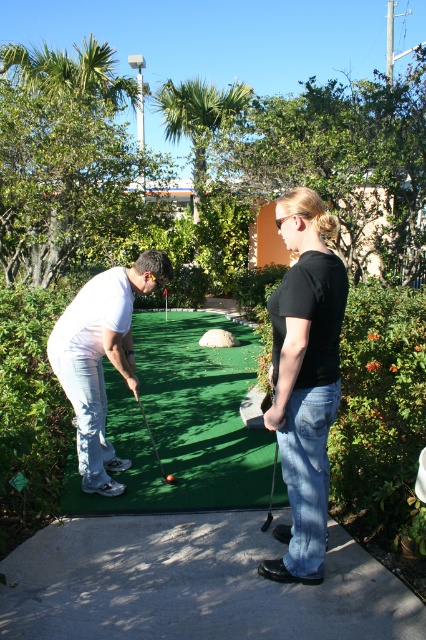
Question: Is white matte golf club at center smaller than glossy plastic golf ball at center?

Choices:
 (A) no
 (B) yes

Answer: (A)

Question: Does metallic silver golf club at center have a greater width compared to glossy plastic golf ball at center?

Choices:
 (A) yes
 (B) no

Answer: (A)

Question: Which object is positioned farthest from the shiny black golf club at center?

Choices:
 (A) black cotton shirt at center
 (B) white matte golf club at center
 (C) metallic silver golf club at center
 (D) green artificial turf at center

Answer: (A)

Question: Which point appears farthest from the camera in this image?

Choices:
 (A) (304, 228)
 (B) (271, 515)
 (C) (218, 412)
 (D) (77, 385)

Answer: (C)

Question: Where is green artificial turf at center located in relation to glossy plastic golf ball at center in the image?

Choices:
 (A) above
 (B) below

Answer: (A)

Question: Which point is closer to the camera?

Choices:
 (A) (291, 369)
 (B) (101, 342)
 (C) (147, 465)

Answer: (A)